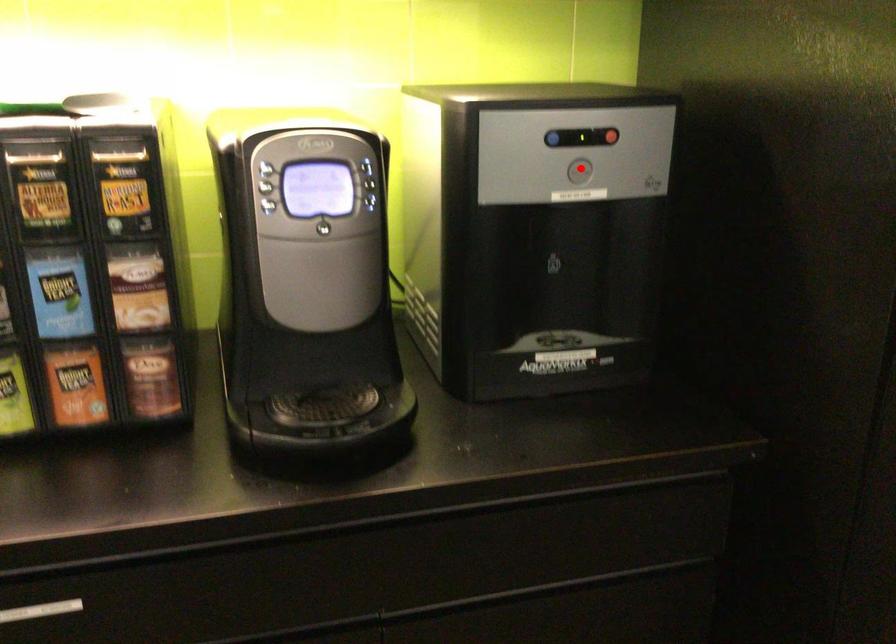
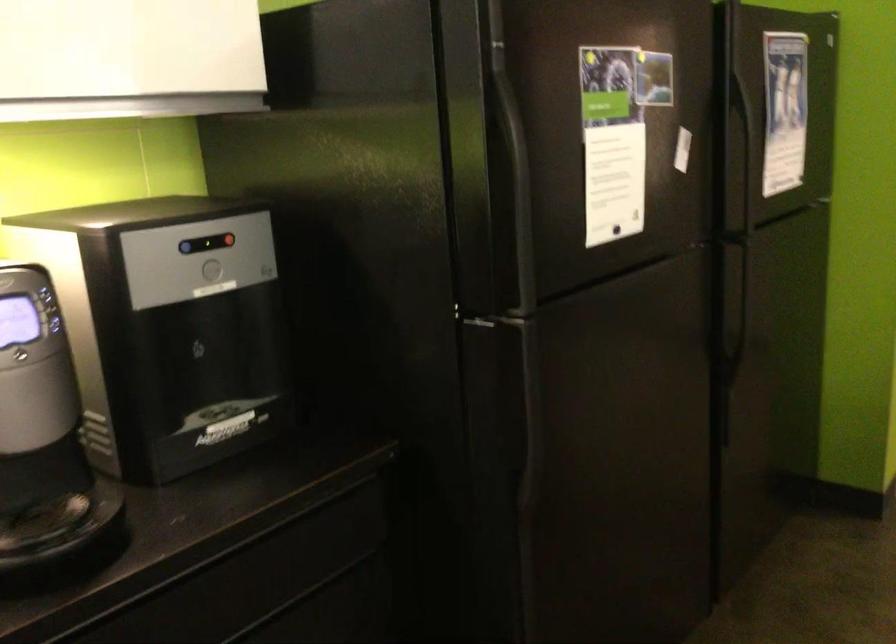
Question: A red point is marked in image1. In image2, is the corresponding 3D point closer to the camera or farther? Reply with the corresponding letter.

Choices:
 (A) The corresponding 3D point is closer.
 (B) The corresponding 3D point is farther.

Answer: (B)